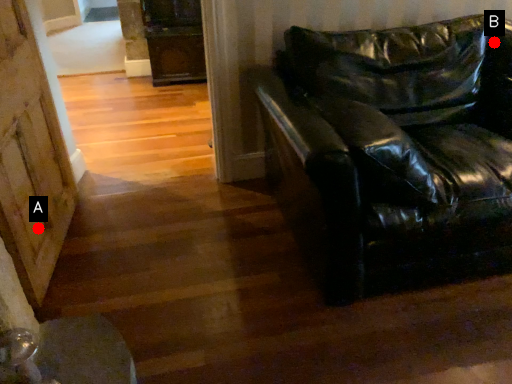
Question: Two points are circled on the image, labeled by A and B beside each circle. Among these points, which one is farthest from the camera?

Choices:
 (A) A is further
 (B) B is further

Answer: (B)